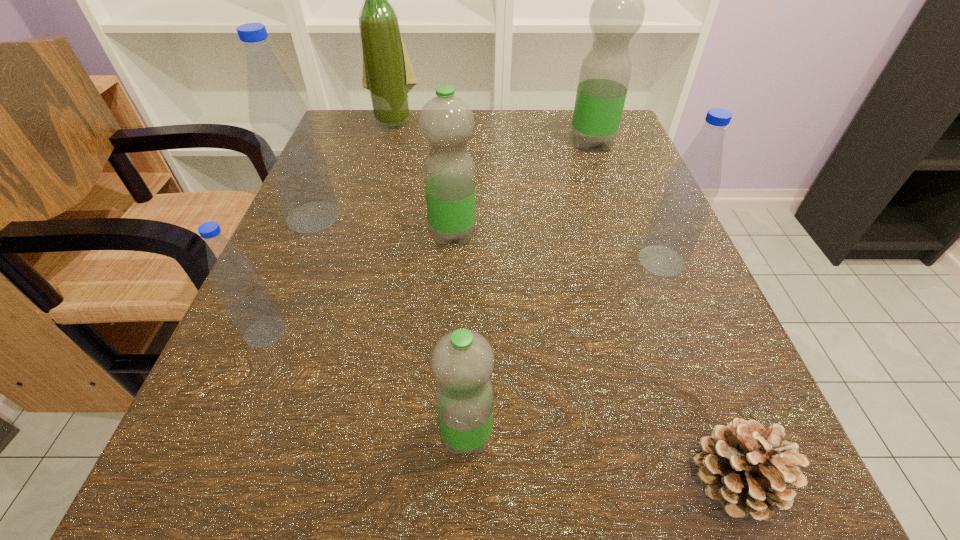
You are a GUI agent. You are given a task and a screenshot of the screen. Output one action in this format:
    pyautogui.click(x=<x>, y=<y>)
    Task: Click on the vacant region located 0.230m on the back of the brown pinecone
    The height and width of the screenshot is (540, 960).
    Given the screenshot: What is the action you would take?
    pyautogui.click(x=659, y=285)

Identify the location of wine bottle located in the far edge section of the desktop. The image size is (960, 540). (388, 74).

You are a GUI agent. You are given a task and a screenshot of the screen. Output one action in this format:
    pyautogui.click(x=<x>, y=<y>)
    Task: Click on the water bottle situated at the far edge
    Image resolution: width=960 pixels, height=540 pixels.
    Given the screenshot: What is the action you would take?
    pyautogui.click(x=617, y=13)

Where is `water bottle that is at the near edge`? The height and width of the screenshot is (540, 960). water bottle that is at the near edge is located at coordinates (462, 361).

Image resolution: width=960 pixels, height=540 pixels. I want to click on pinecone located at the near edge, so click(x=745, y=466).

The width and height of the screenshot is (960, 540). I want to click on wine bottle that is positioned at the left edge, so click(x=388, y=74).

Identify the location of pinecone located at the right edge. (745, 466).

The height and width of the screenshot is (540, 960). I want to click on object that is positioned at the far left corner, so click(x=388, y=74).

This screenshot has height=540, width=960. Find the location of `object present at the far right corner`. object present at the far right corner is located at coordinates (617, 13).

This screenshot has width=960, height=540. In order to click on object at the near right corner in this screenshot , I will do `click(745, 466)`.